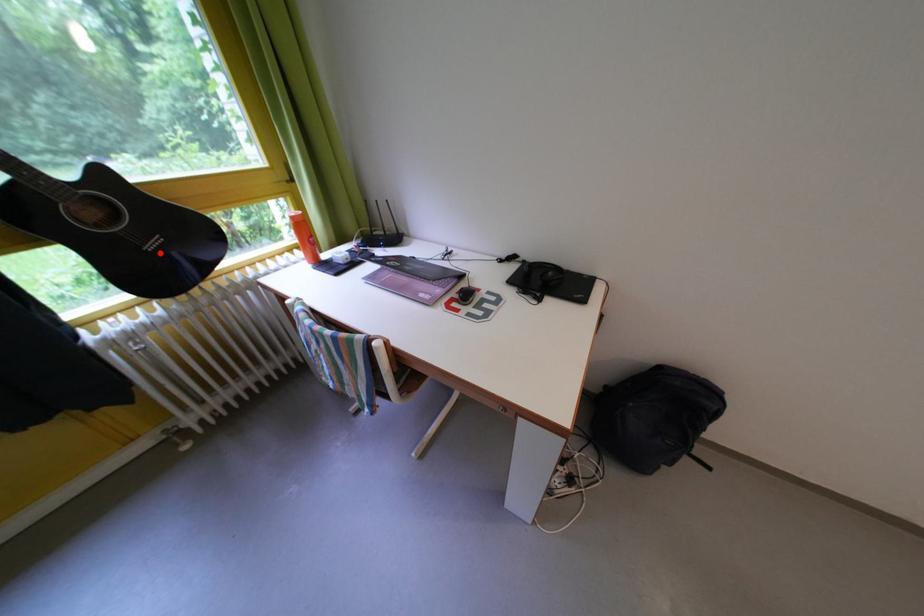
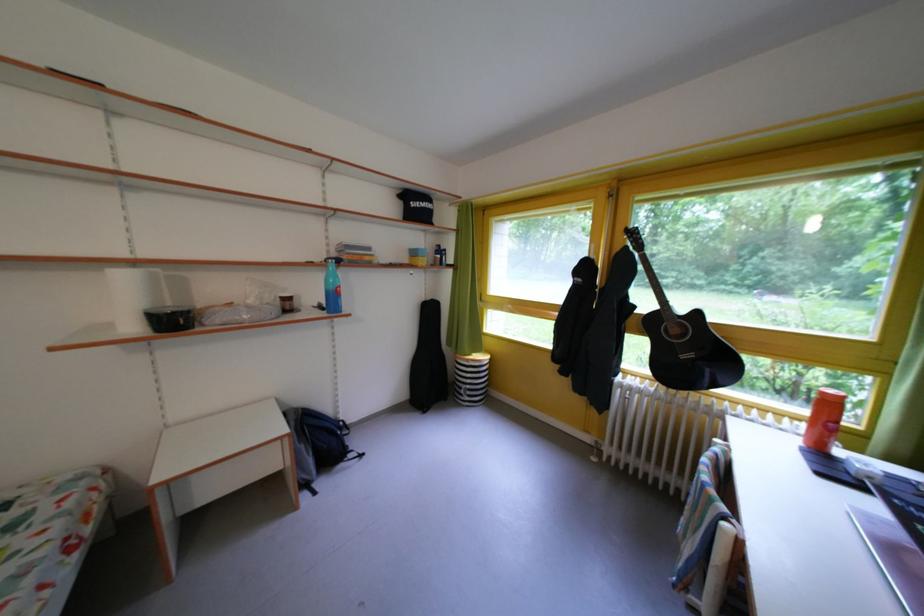
Where in the second image is the point corresponding to the highlighted location from the first image?

(693, 362)